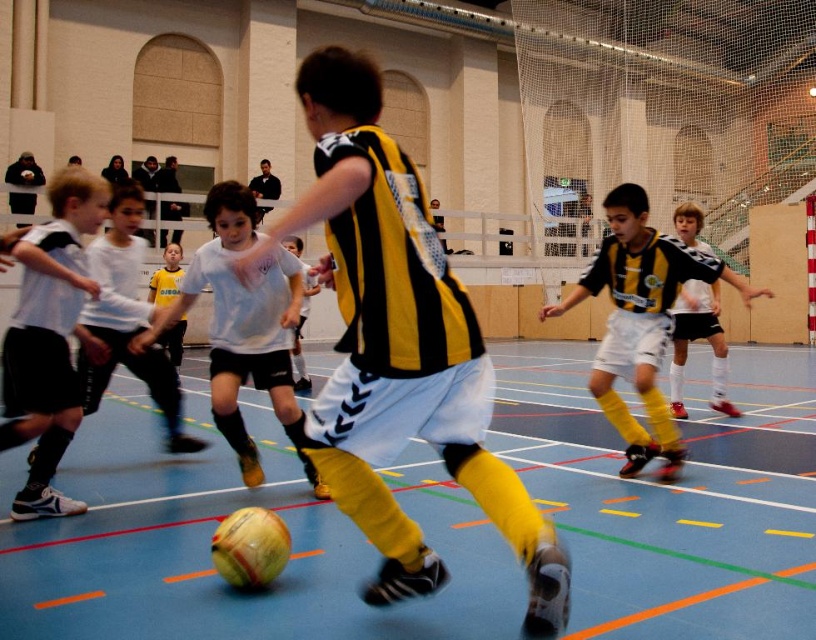
Which is below, white matte shorts at left or yellow jersey at center?

white matte shorts at left is lower down.

Does white matte shorts at left appear on the left side of yellow jersey at center?

In fact, white matte shorts at left is to the right of yellow jersey at center.

Which is in front, point (33, 241) or point (149, 289)?

Positioned in front is point (33, 241).

Where is `white matte shorts at left`? white matte shorts at left is located at coordinates (50, 337).

Does point (661, 397) lie in front of point (278, 284)?

No, it is behind (278, 284).

Based on the photo, is yellow and black jersey at center bigger than white matte jersey at center?

Yes.

You are a GUI agent. You are given a task and a screenshot of the screen. Output one action in this format:
    pyautogui.click(x=<x>, y=<y>)
    Task: Click on the yellow and black jersey at center
    
    Given the screenshot: What is the action you would take?
    pyautogui.click(x=641, y=321)

Between white matte shorts at left and yellow and black jersey at center, which one appears on the right side from the viewer's perspective?

yellow and black jersey at center

Is white matte shorts at left positioned at the back of yellow and black jersey at center?

That is False.

This screenshot has height=640, width=816. What are the coordinates of `white matte shorts at left` in the screenshot? It's located at (50, 337).